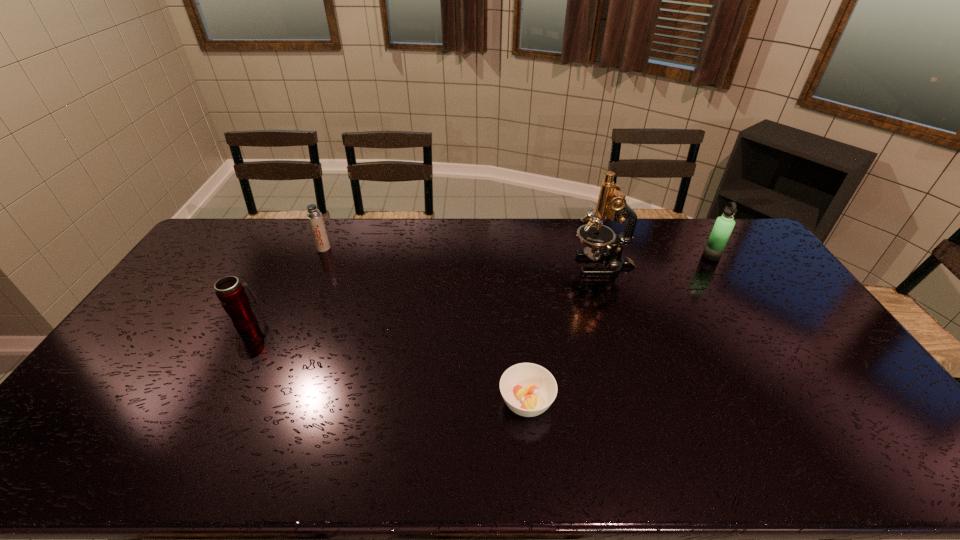
Find the location of a particular element. This screenshot has height=540, width=960. vacant point that satisfies the following two spatial constraints: 1. on the side with the handle of the second nearest object; 2. on the left side of the second thermos bottle from right to left is located at coordinates (288, 248).

You are a GUI agent. You are given a task and a screenshot of the screen. Output one action in this format:
    pyautogui.click(x=<x>, y=<y>)
    Task: Click on the free space that satisfies the following two spatial constraints: 1. on the front side of the tallest thermos bottle; 2. at the eyepiece of the tallest object
    This screenshot has width=960, height=540.
    Given the screenshot: What is the action you would take?
    pyautogui.click(x=717, y=265)

I want to click on free space that satisfies the following two spatial constraints: 1. on the front side of the tallest thermos bottle; 2. at the eyepiece of the microscope, so click(x=717, y=265).

I want to click on vacant space that satisfies the following two spatial constraints: 1. on the back side of the rightmost object; 2. on the right side of the shortest object, so click(x=514, y=256).

Identify the location of vacant space that satisfies the following two spatial constraints: 1. on the front side of the soup bowl; 2. on the right side of the fourth object from right to left. Image resolution: width=960 pixels, height=540 pixels. (255, 402).